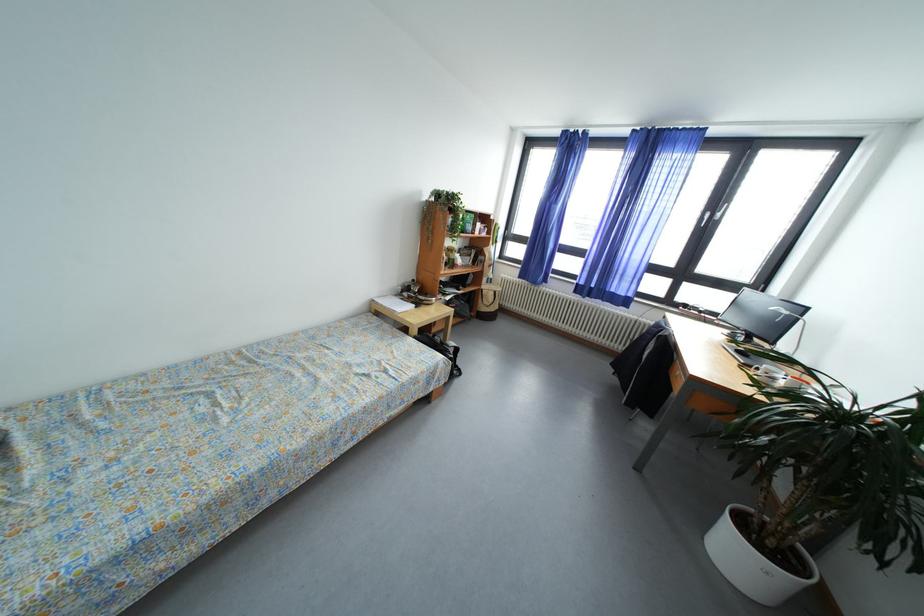
This screenshot has width=924, height=616. Describe the element at coordinates (755, 562) in the screenshot. I see `a woven wastebasket` at that location.